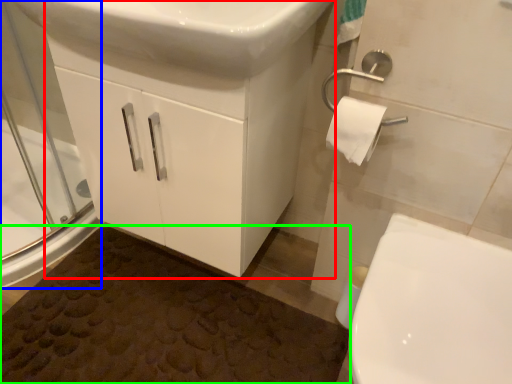
Question: Which is farther away from bathroom cabinet (highlighted by a red box)? screen door (highlighted by a blue box) or bath mat (highlighted by a green box)?

Choices:
 (A) screen door
 (B) bath mat

Answer: (A)